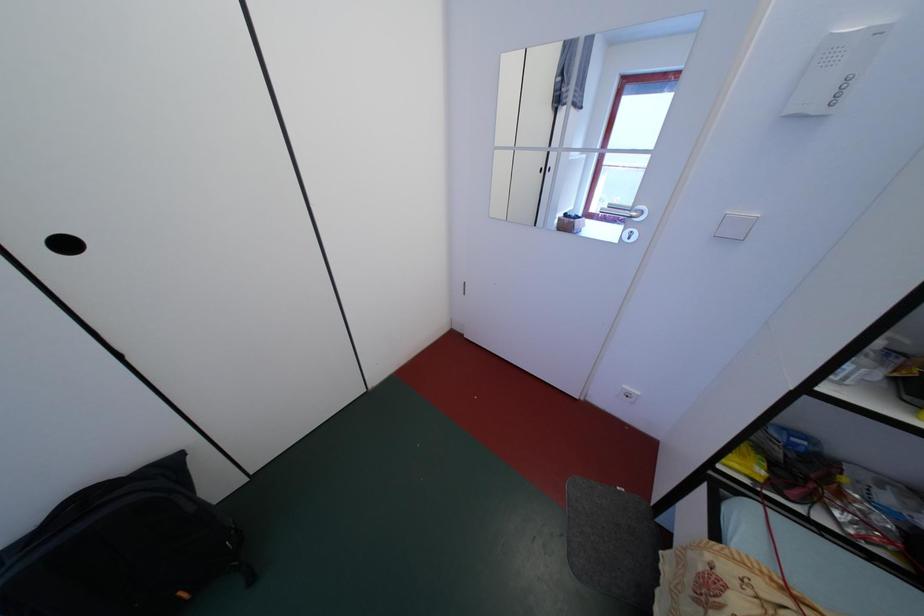
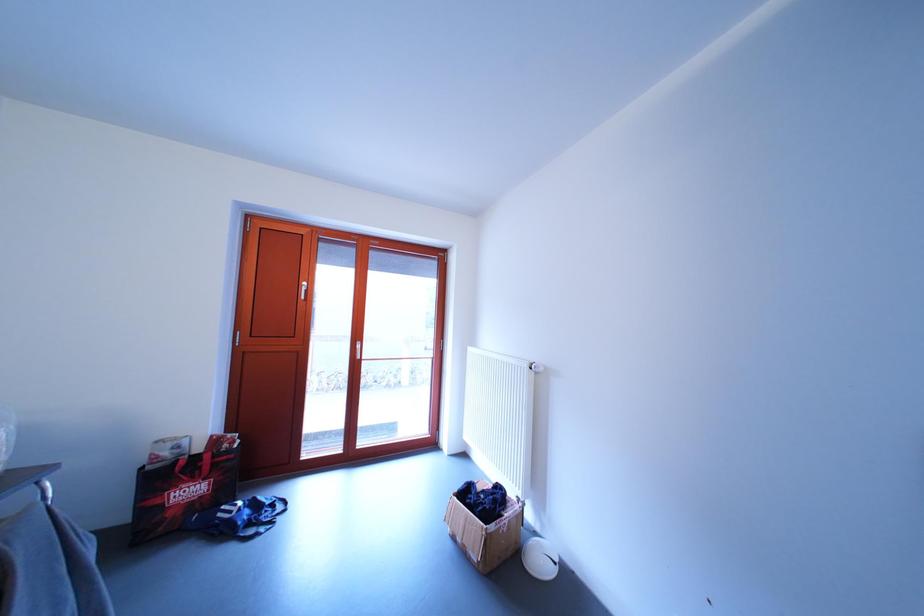
Question: The images are taken continuously from a first-person perspective. In which direction is your viewpoint rotating?

Choices:
 (A) Left
 (B) Right
 (C) Up
 (D) Down

Answer: (A)